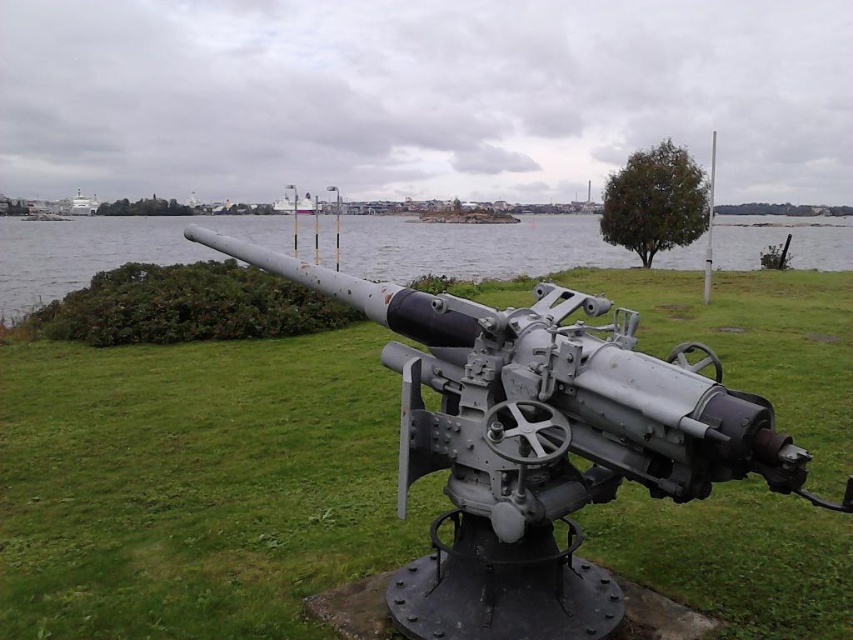
Question: Which of the following is the closest to the observer?

Choices:
 (A) gray metallic water at center
 (B) gray metallic cannon at center

Answer: (B)

Question: Is gray metallic cannon at center thinner than gray metallic water at center?

Choices:
 (A) no
 (B) yes

Answer: (B)

Question: Does gray metallic cannon at center appear over gray metallic water at center?

Choices:
 (A) yes
 (B) no

Answer: (B)

Question: Which point is farther from the camera taking this photo?

Choices:
 (A) (421, 632)
 (B) (21, 241)

Answer: (B)

Question: Does gray metallic cannon at center appear on the right side of gray metallic water at center?

Choices:
 (A) yes
 (B) no

Answer: (A)